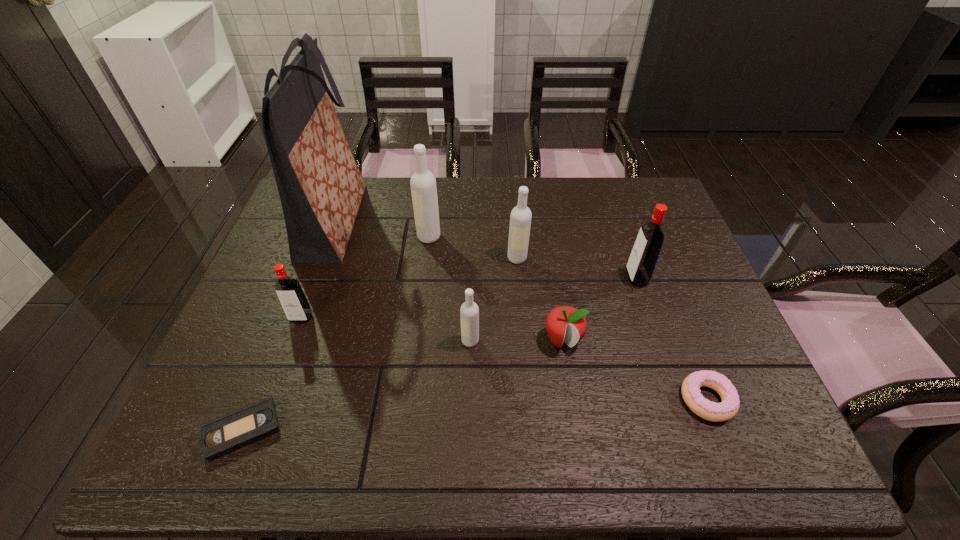
Where is `the leftmost vodka`? The image size is (960, 540). the leftmost vodka is located at coordinates (291, 296).

Where is `red apple`? This screenshot has width=960, height=540. red apple is located at coordinates (566, 324).

The image size is (960, 540). Find the location of `apple`. apple is located at coordinates [x=566, y=324].

Find the location of a particular element. The height and width of the screenshot is (540, 960). the eighth tallest object is located at coordinates (729, 406).

Identify the location of pink doughnut. This screenshot has width=960, height=540. (729, 406).

At what (x,y) coordinates should I click in order to perform the action: click on the shortest object. Please return your answer as a coordinate pair (x, y). The height and width of the screenshot is (540, 960). Looking at the image, I should click on (230, 432).

Locate an element on the screen. This screenshot has width=960, height=540. vacant point located on the front-facing side of the shopping bag is located at coordinates pos(388,220).

At what (x,y) coordinates should I click in order to perform the action: click on free location located 0.050m on the right of the farthest vodka. Please return your answer as a coordinate pair (x, y). The image size is (960, 540). Looking at the image, I should click on (457, 237).

The height and width of the screenshot is (540, 960). I want to click on free spot located on the left of the fourth object from right to left, so click(392, 258).

What are the coordinates of `vacant space situated on the front and back of the rightmost vodka` in the screenshot? It's located at pos(609,278).